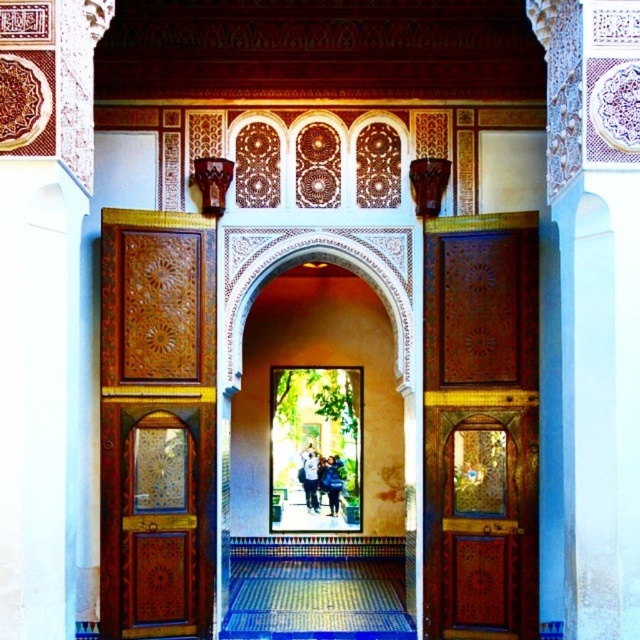
Question: Is polished wood door at right to the right of blue denim jacket at center from the viewer's perspective?

Choices:
 (A) yes
 (B) no

Answer: (A)

Question: Among these objects, which one is farthest from the camera?

Choices:
 (A) blue denim jacket at center
 (B) light blue jeans at center
 (C) polished wood door at left
 (D) polished wood door at right

Answer: (B)

Question: Is polished wood door at right to the left of light blue jeans at center from the viewer's perspective?

Choices:
 (A) yes
 (B) no

Answer: (B)

Question: Is light blue jeans at center to the left of blue denim jacket at center from the viewer's perspective?

Choices:
 (A) yes
 (B) no

Answer: (A)

Question: Which point is farther to the camera?

Choices:
 (A) (337, 502)
 (B) (172, 608)

Answer: (A)

Question: Which point is closer to the camera?

Choices:
 (A) (154, 422)
 (B) (308, 472)
 (C) (337, 490)
 (D) (445, 573)

Answer: (A)